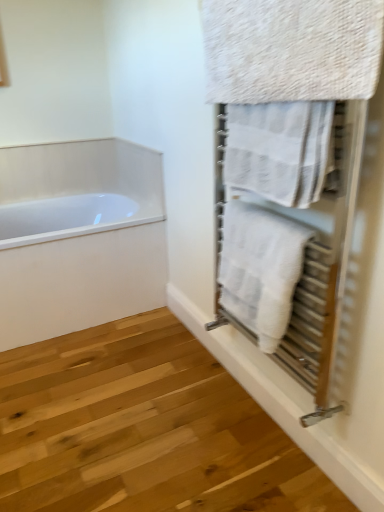
Question: From a real-world perspective, is white textured towel at upper right, acting as the second towel starting from the top, on top of white textured towel at right, positioned as the third towel in top-to-bottom order?

Choices:
 (A) yes
 (B) no

Answer: (A)

Question: From the image's perspective, is white textured towel at upper right, acting as the second towel starting from the top, on white textured towel at right, the first towel positioned from the bottom?

Choices:
 (A) yes
 (B) no

Answer: (A)

Question: Does white textured towel at upper right, acting as the second towel starting from the top, have a lesser width compared to white textured towel at right, positioned as the third towel in top-to-bottom order?

Choices:
 (A) no
 (B) yes

Answer: (B)

Question: Is white textured towel at upper right, acting as the second towel starting from the top, positioned before white textured towel at right, positioned as the third towel in top-to-bottom order?

Choices:
 (A) yes
 (B) no

Answer: (A)

Question: Would you consider white textured towel at upper right, arranged as the 2th towel when ordered from the bottom, to be distant from white textured towel at right, positioned as the third towel in top-to-bottom order?

Choices:
 (A) yes
 (B) no

Answer: (B)

Question: In terms of height, does white textured towel at right, the first towel positioned from the bottom, look taller or shorter compared to white textured towel at upper right, arranged as the 2th towel when ordered from the bottom?

Choices:
 (A) short
 (B) tall

Answer: (B)

Question: Is white textured towel at right, the first towel positioned from the bottom, in front of or behind white textured towel at upper right, arranged as the 2th towel when ordered from the bottom, in the image?

Choices:
 (A) front
 (B) behind

Answer: (B)

Question: From the image's perspective, is white textured towel at right, positioned as the third towel in top-to-bottom order, above or below white textured towel at upper right, acting as the second towel starting from the top?

Choices:
 (A) above
 (B) below

Answer: (B)

Question: From a real-world perspective, is white textured towel at right, positioned as the third towel in top-to-bottom order, above or below white textured towel at upper right, arranged as the 2th towel when ordered from the bottom?

Choices:
 (A) above
 (B) below

Answer: (B)

Question: From a real-world perspective, is textured beige towel at upper right, the third towel from the bottom, positioned above or below white textured towel at right, positioned as the third towel in top-to-bottom order?

Choices:
 (A) below
 (B) above

Answer: (B)

Question: Looking at the image, does textured beige towel at upper right, arranged as the 1th towel when viewed from the top, seem bigger or smaller compared to white textured towel at right, positioned as the third towel in top-to-bottom order?

Choices:
 (A) small
 (B) big

Answer: (A)

Question: Is textured beige towel at upper right, the third towel from the bottom, inside the boundaries of white textured towel at right, the first towel positioned from the bottom, or outside?

Choices:
 (A) outside
 (B) inside

Answer: (A)

Question: Is point (332, 2) positioned closer to the camera than point (251, 219)?

Choices:
 (A) farther
 (B) closer

Answer: (B)

Question: Would you say textured beige towel at upper right, arranged as the 1th towel when viewed from the top, is inside or outside white textured towel at upper right, arranged as the 2th towel when ordered from the bottom?

Choices:
 (A) outside
 (B) inside

Answer: (A)

Question: From a real-world perspective, relative to white textured towel at upper right, acting as the second towel starting from the top, is textured beige towel at upper right, arranged as the 1th towel when viewed from the top, vertically above or below?

Choices:
 (A) below
 (B) above

Answer: (B)